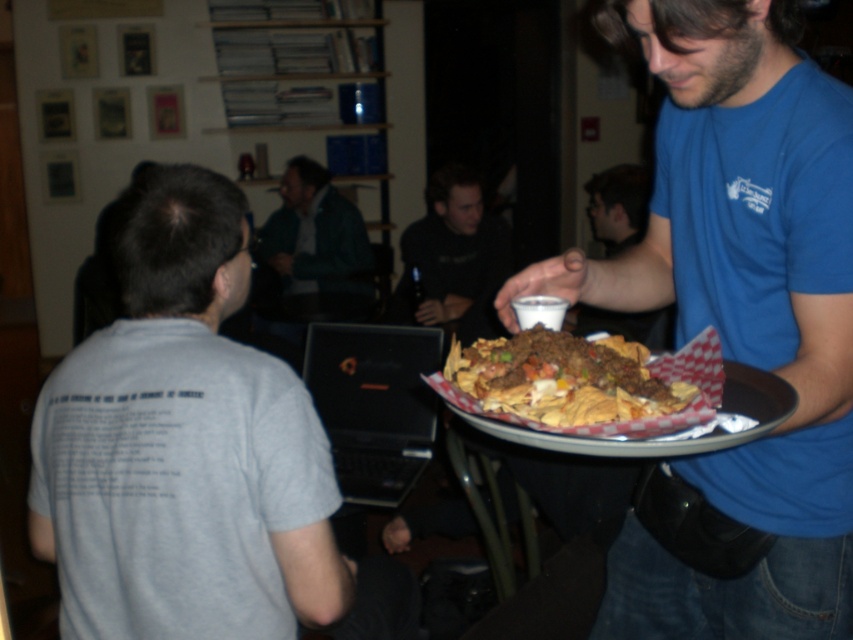
You are standing in the cafe and want to take a photo of both the man with the nachos and the person seated facing away from the camera. Which point, point (308, 344) or point (369, 266), is closer to the camera?

Point (308, 344) is closer to the camera than point (369, 266).